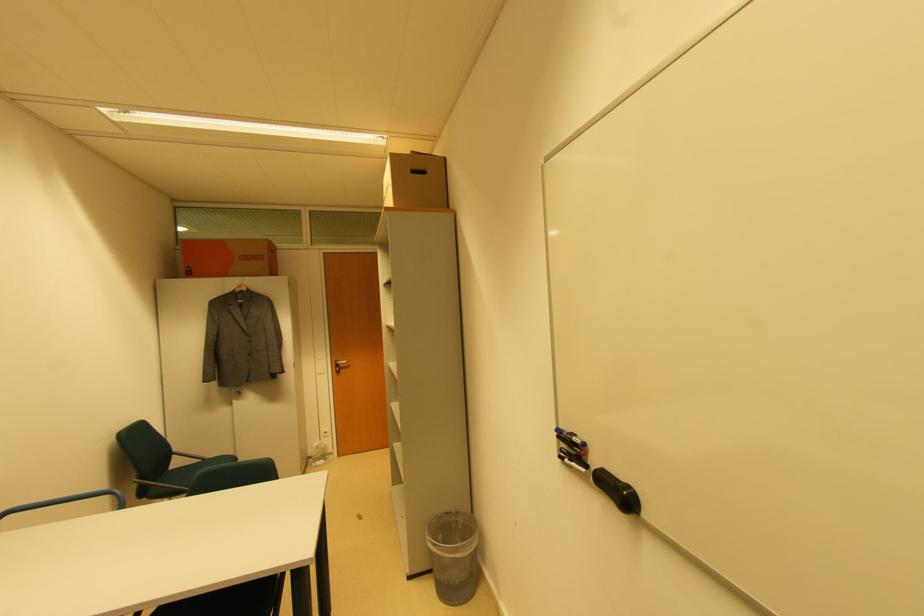
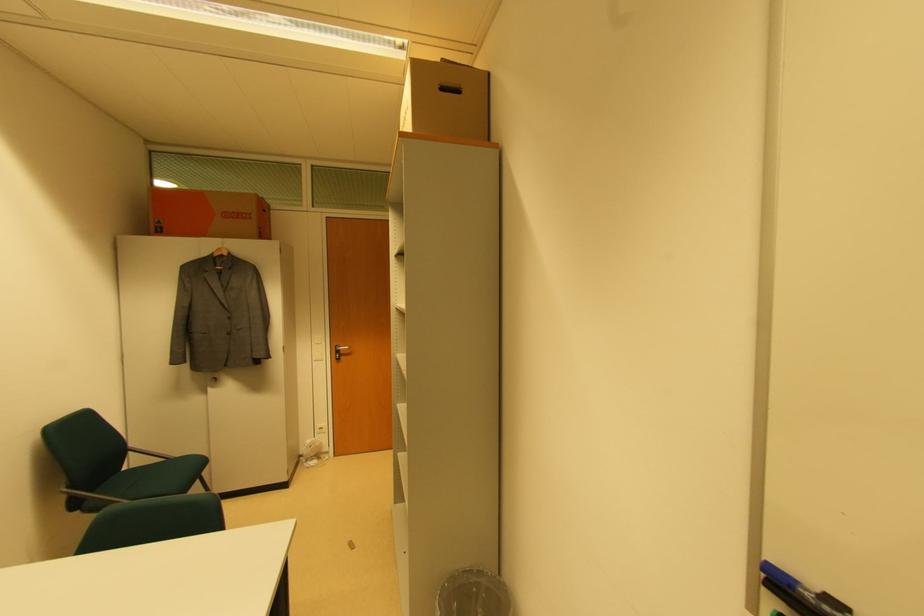
The point at (x=192, y=274) is marked in the first image. Where is the corresponding point in the second image?

(163, 230)